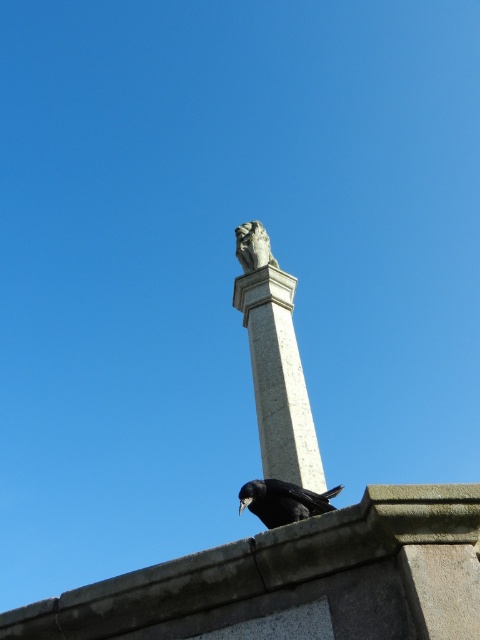
You are a photographer standing in front of the monument. You want to capture a photo where both the white stone column at upper center and the shiny black bird at center are visible. Based on their positions, which object should you focus on first to ensure both are in the frame?

The white stone column at upper center is above the shiny black bird at center. To ensure both are in the frame, focus on the shiny black bird at center first since it is lower and the column is above it, allowing the camera to capture both vertically.

You are an architect inspecting a monument. You notice the white stone column at upper center and the shiny black bird at center. Which object is bigger in size?

The white stone column at upper center has a larger size compared to the shiny black bird at center, so the white stone column at upper center is bigger.

You are standing in front of a monument and see the white stone column at upper center and the shiny black bird at center. Which object is located to the left of the other?

The white stone column at upper center is positioned on the left side of shiny black bird at center, so the column is to the left of the bird.